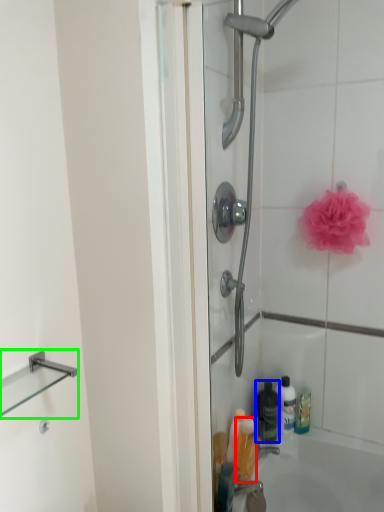
Question: Considering the real-world distances, which object is closest to toiletry (highlighted by a red box)? bottle (highlighted by a blue box) or balustrade (highlighted by a green box).

Choices:
 (A) bottle
 (B) balustrade

Answer: (A)